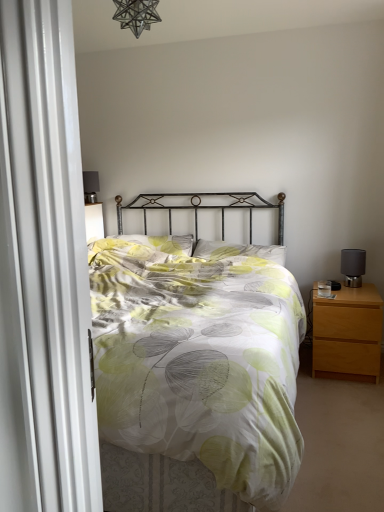
Question: Can you confirm if light brown wood nightstand at right is taller than printed fabric bed at center?

Choices:
 (A) no
 (B) yes

Answer: (A)

Question: Is light brown wood nightstand at right to the left of printed fabric bed at center from the viewer's perspective?

Choices:
 (A) no
 (B) yes

Answer: (A)

Question: Would you consider light brown wood nightstand at right to be distant from printed fabric bed at center?

Choices:
 (A) yes
 (B) no

Answer: (B)

Question: Is the position of light brown wood nightstand at right less distant than that of printed fabric bed at center?

Choices:
 (A) yes
 (B) no

Answer: (B)

Question: Is light brown wood nightstand at right smaller than printed fabric bed at center?

Choices:
 (A) no
 (B) yes

Answer: (B)

Question: Is light brown wood nightstand at right positioned behind printed fabric bed at center?

Choices:
 (A) no
 (B) yes

Answer: (B)

Question: Is metallic star-shaped light fixture at upper center at the left side of printed fabric bed at center?

Choices:
 (A) no
 (B) yes

Answer: (B)

Question: Is metallic star-shaped light fixture at upper center positioned behind printed fabric bed at center?

Choices:
 (A) no
 (B) yes

Answer: (B)

Question: Considering the relative sizes of metallic star-shaped light fixture at upper center and printed fabric bed at center in the image provided, is metallic star-shaped light fixture at upper center taller than printed fabric bed at center?

Choices:
 (A) yes
 (B) no

Answer: (B)

Question: Is there a large distance between metallic star-shaped light fixture at upper center and printed fabric bed at center?

Choices:
 (A) yes
 (B) no

Answer: (A)

Question: From the image's perspective, would you say metallic star-shaped light fixture at upper center is positioned over printed fabric bed at center?

Choices:
 (A) no
 (B) yes

Answer: (B)

Question: Is metallic star-shaped light fixture at upper center positioned with its back to printed fabric bed at center?

Choices:
 (A) no
 (B) yes

Answer: (A)

Question: Considering the relative sizes of white fabric pillow at center, acting as the 2th pillow starting from the left, and metallic star-shaped light fixture at upper center in the image provided, is white fabric pillow at center, acting as the 2th pillow starting from the left, shorter than metallic star-shaped light fixture at upper center?

Choices:
 (A) no
 (B) yes

Answer: (B)